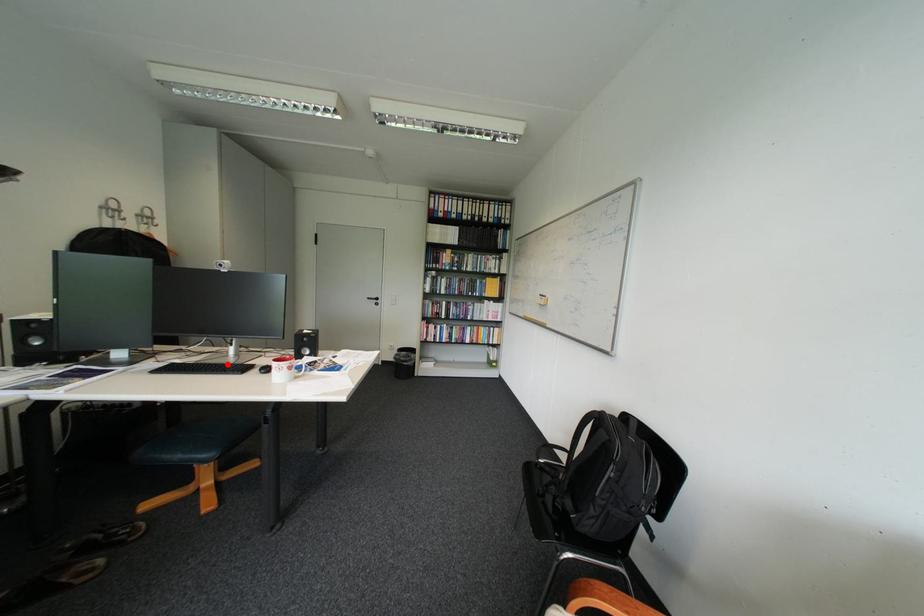
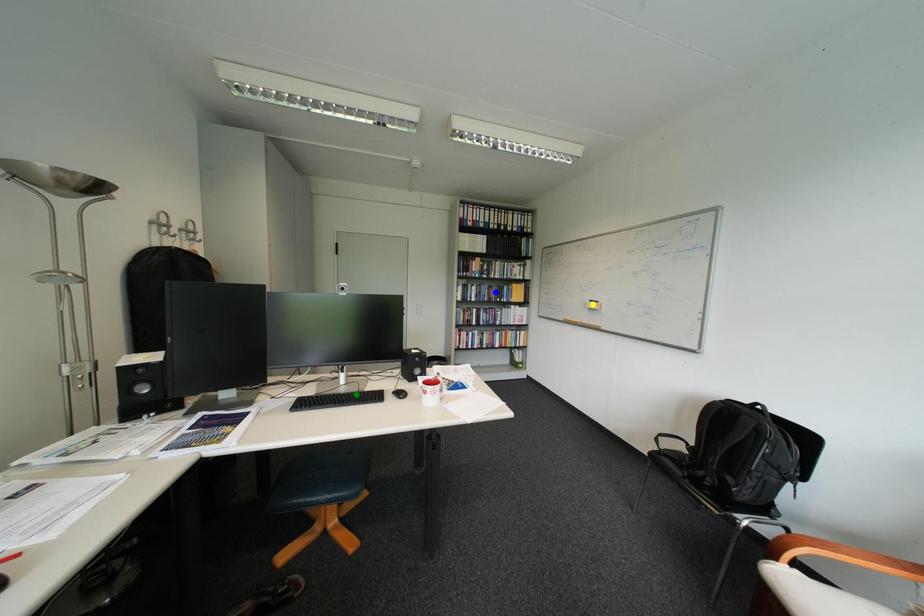
Question: I am providing you with two images of the same scene from different viewpoints. A red point is marked on the first image. You are given multiple points on the second image. Which point in image 2 represents the same 3d spot as the red point in image 1?

Choices:
 (A) green point
 (B) yellow point
 (C) blue point

Answer: (A)